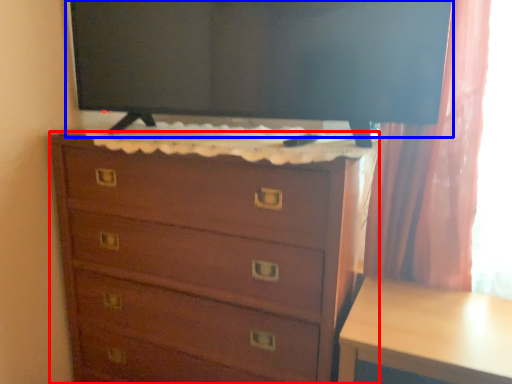
Question: Among these objects, which one is farthest to the camera, chest of drawers (highlighted by a red box) or tv show (highlighted by a blue box)?

Choices:
 (A) chest of drawers
 (B) tv show

Answer: (B)